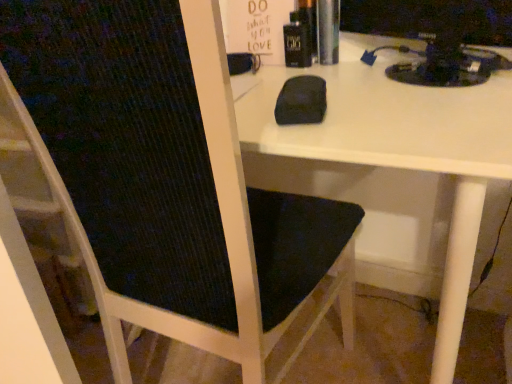
What are the coordinates of `free space to the left of black plastic monitor at upper right` in the screenshot? It's located at point(327,89).